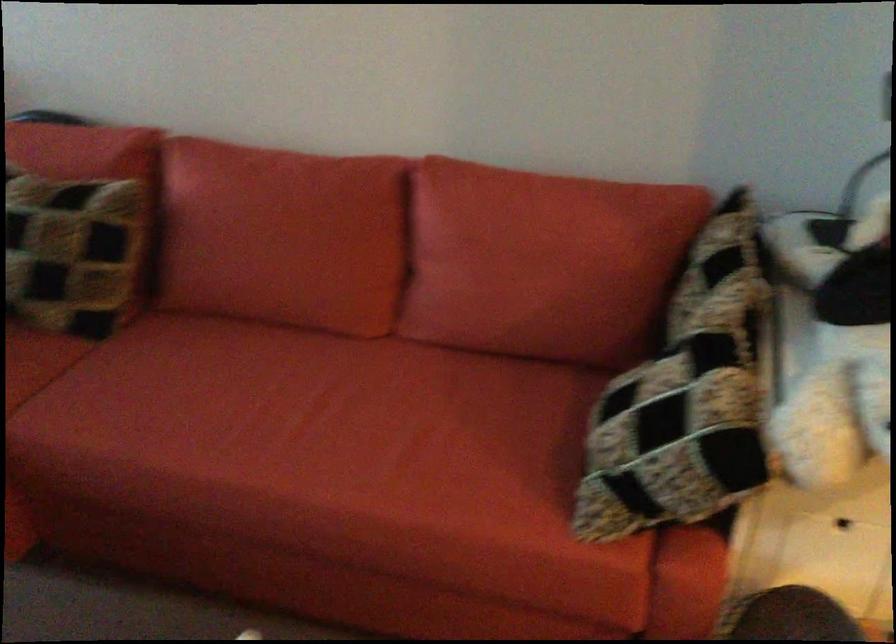
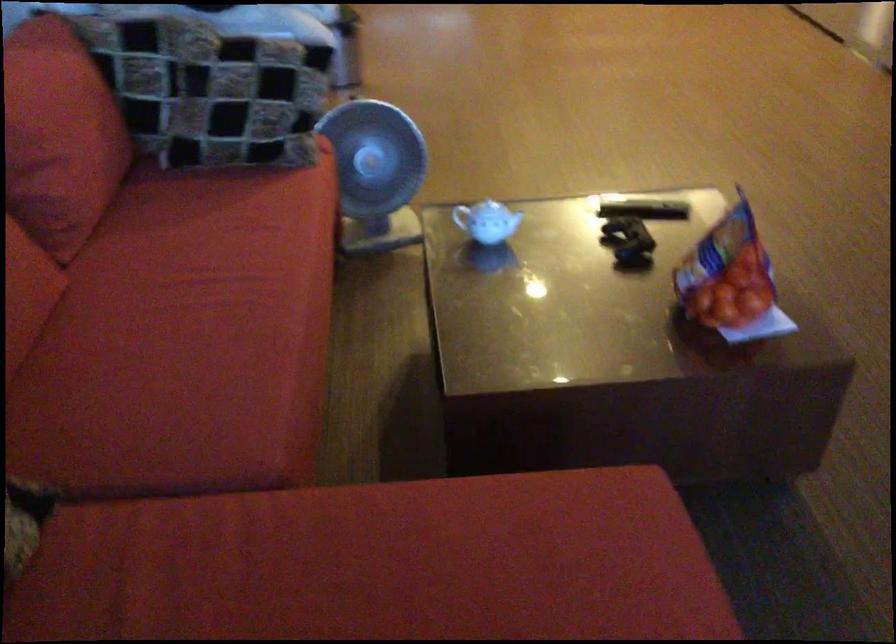
Where in the second image is the point corresponding to pixel 234 395 from the first image?

(192, 330)